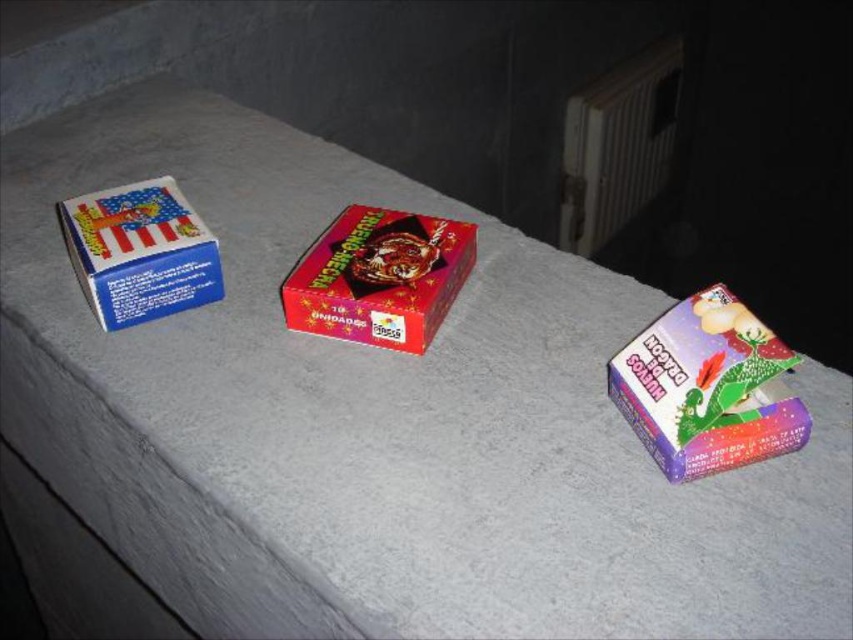
You are organizing a collection of boxes on a shelf. You have the shiny red box at center and the blue matte matchbox at left. Which box should you place first if you want to arrange them from shortest to tallest?

The shiny red box at center has a lesser height compared to the blue matte matchbox at left, so you should place the shiny red box at center first when arranging from shortest to tallest.

From the picture: You are standing in the room and want to pick up the shiny red box at center and the blue matte matchbox at left. Which box will you need to lean forward more to reach?

The shiny red box at center is closer to the viewer than the blue matte matchbox at left, so you will need to lean forward more to reach the blue matte matchbox at left.